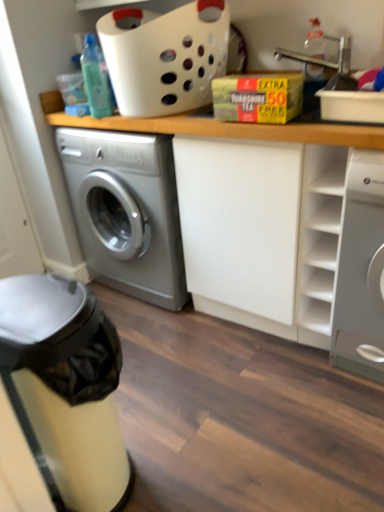
This screenshot has width=384, height=512. Describe the element at coordinates (221, 127) in the screenshot. I see `wooden counter at center` at that location.

Where is `white glossy washing machine at right`? The height and width of the screenshot is (512, 384). white glossy washing machine at right is located at coordinates (361, 271).

Is matte silver dishwasher at lower left completely or partially inside translucent plastic bottle at upper left, the first bottle positioned from the left?

Definitely not — matte silver dishwasher at lower left is not inside translucent plastic bottle at upper left, the first bottle positioned from the left.

Is translucent plastic bottle at upper left, placed as the second bottle when sorted from right to left, in front of matte silver dishwasher at lower left?

No, translucent plastic bottle at upper left, placed as the second bottle when sorted from right to left, is further to the viewer.

Which of these two, translucent plastic bottle at upper left, the first bottle positioned from the left, or matte silver dishwasher at lower left, is thinner?

Thinner between the two is translucent plastic bottle at upper left, the first bottle positioned from the left.

From a real-world perspective, which is physically above, matte silver dishwasher at lower left or wooden counter at center?

From a 3D spatial view, wooden counter at center is above.

In the image, is matte silver dishwasher at lower left positioned in front of or behind wooden counter at center?

Clearly, matte silver dishwasher at lower left is in front of wooden counter at center.

Looking at this image, is matte silver dishwasher at lower left oriented towards wooden counter at center?

Yes, matte silver dishwasher at lower left is oriented towards wooden counter at center.

Based on the photo, from the image's perspective, is wooden counter at center above or below translucent plastic bottle at upper left, the first bottle positioned from the left?

Based on their image positions, wooden counter at center is located beneath translucent plastic bottle at upper left, the first bottle positioned from the left.

Considering the positions of point (258, 129) and point (104, 64), is point (258, 129) closer or farther from the camera than point (104, 64)?

Point (258, 129).

In the scene shown: Considering the sizes of objects wooden counter at center and translucent plastic bottle at upper left, placed as the second bottle when sorted from right to left, in the image provided, who is taller, wooden counter at center or translucent plastic bottle at upper left, placed as the second bottle when sorted from right to left,?

With more height is wooden counter at center.

Considering the relative sizes of wooden counter at center and translucent plastic bottle at upper left, the first bottle positioned from the left, in the image provided, is wooden counter at center bigger than translucent plastic bottle at upper left, the first bottle positioned from the left,?

Yes, wooden counter at center is bigger than translucent plastic bottle at upper left, the first bottle positioned from the left.

Measure the distance between translucent plastic bottle at upper left, placed as the second bottle when sorted from right to left, and white plastic basket at upper center.

translucent plastic bottle at upper left, placed as the second bottle when sorted from right to left, and white plastic basket at upper center are 9.27 inches apart from each other.

Locate an element on the screen. Image resolution: width=384 pixels, height=512 pixels. basket in front of the translucent plastic bottle at upper left, the first bottle positioned from the left is located at coordinates click(x=165, y=56).

Is translucent plastic bottle at upper left, the first bottle positioned from the left, oriented towards white plastic basket at upper center?

Yes, translucent plastic bottle at upper left, the first bottle positioned from the left, is facing white plastic basket at upper center.

Who is taller, translucent plastic bottle at upper left, placed as the second bottle when sorted from right to left, or white plastic basket at upper center?

With more height is white plastic basket at upper center.

What's the angular difference between matte silver dishwasher at lower left and translucent plastic bottle at upper left, placed as the second bottle when sorted from right to left,'s facing directions?

The facing directions of matte silver dishwasher at lower left and translucent plastic bottle at upper left, placed as the second bottle when sorted from right to left, are 175 degrees apart.

From a real-world perspective, between matte silver dishwasher at lower left and translucent plastic bottle at upper left, placed as the second bottle when sorted from right to left, who is vertically higher?

translucent plastic bottle at upper left, placed as the second bottle when sorted from right to left, from a real-world perspective.

Visually, is matte silver dishwasher at lower left positioned to the left or to the right of translucent plastic bottle at upper left, the first bottle positioned from the left?

matte silver dishwasher at lower left is positioned on translucent plastic bottle at upper left, the first bottle positioned from the left,'s left side.

Considering the positions of points (119, 449) and (100, 80), is point (119, 449) closer to camera compared to point (100, 80)?

Yes, point (119, 449) is in front of point (100, 80).

Is matte silver dishwasher at lower left turned away from white plastic basket at upper center?

No, matte silver dishwasher at lower left is not facing away from white plastic basket at upper center.

Which is in front, point (8, 391) or point (222, 42)?

The point (8, 391) is more forward.

Considering the sizes of matte silver dishwasher at lower left and white plastic basket at upper center in the image, is matte silver dishwasher at lower left bigger or smaller than white plastic basket at upper center?

matte silver dishwasher at lower left is bigger than white plastic basket at upper center.

I want to click on dish washer below the clear plastic bottle at upper right, positioned as the 1th bottle in right-to-left order (from the image's perspective), so click(65, 389).

Which object is positioned more to the right, matte silver dishwasher at lower left or clear plastic bottle at upper right, the second bottle positioned from the left?

clear plastic bottle at upper right, the second bottle positioned from the left.

Who is taller, matte silver dishwasher at lower left or clear plastic bottle at upper right, positioned as the 1th bottle in right-to-left order?

matte silver dishwasher at lower left is taller.

Is matte silver dishwasher at lower left spatially inside clear plastic bottle at upper right, positioned as the 1th bottle in right-to-left order, or outside of it?

matte silver dishwasher at lower left exists outside the volume of clear plastic bottle at upper right, positioned as the 1th bottle in right-to-left order.

From the matte silver dishwasher at lower left, count 1st bottle to the right and point to it. Please provide its 2D coordinates.

[(96, 79)]

The image size is (384, 512). Find the location of `counter top behind the matte silver dishwasher at lower left`. counter top behind the matte silver dishwasher at lower left is located at coordinates (221, 127).

From the image, which object appears to be farther from white plastic basket at upper center, wooden counter at center or white glossy washing machine at right?

white glossy washing machine at right lies further to white plastic basket at upper center than the other object.

Which object lies further to the anchor point matte silver dishwasher at lower left, translucent plastic bottle at upper left, placed as the second bottle when sorted from right to left, or clear plastic bottle at upper right, positioned as the 1th bottle in right-to-left order?

clear plastic bottle at upper right, positioned as the 1th bottle in right-to-left order, is positioned further to the anchor matte silver dishwasher at lower left.

Consider the image. Which object lies nearer to the anchor point translucent plastic bottle at upper left, placed as the second bottle when sorted from right to left, matte silver dishwasher at lower left or white glossy washing machine at right?

white glossy washing machine at right is positioned closer to the anchor translucent plastic bottle at upper left, placed as the second bottle when sorted from right to left.

In the scene shown: Considering their positions, is wooden counter at center positioned closer to white glossy washing machine at right than clear plastic bottle at upper right, positioned as the 1th bottle in right-to-left order?

The object closer to white glossy washing machine at right is wooden counter at center.

Looking at the image, which one is located closer to white plastic basket at upper center, clear plastic bottle at upper right, the second bottle positioned from the left, or wooden counter at center?

wooden counter at center is closer to white plastic basket at upper center.

Considering their positions, is white glossy washing machine at right positioned closer to matte silver dishwasher at lower left than clear plastic bottle at upper right, positioned as the 1th bottle in right-to-left order?

white glossy washing machine at right is positioned closer to the anchor matte silver dishwasher at lower left.

Estimate the real-world distances between objects in this image. Which object is further from white glossy washing machine at right, translucent plastic bottle at upper left, placed as the second bottle when sorted from right to left, or matte silver dishwasher at lower left?

translucent plastic bottle at upper left, placed as the second bottle when sorted from right to left, is positioned further to the anchor white glossy washing machine at right.

When comparing their distances from white glossy washing machine at right, does clear plastic bottle at upper right, the second bottle positioned from the left, or matte silver dishwasher at lower left seem further?

Based on the image, matte silver dishwasher at lower left appears to be further to white glossy washing machine at right.

The width and height of the screenshot is (384, 512). Identify the location of counter top between clear plastic bottle at upper right, the second bottle positioned from the left, and white glossy washing machine at right from top to bottom. (221, 127).

At what (x,y) coordinates should I click in order to perform the action: click on bottle located between white plastic basket at upper center and white glossy washing machine at right in the left-right direction. Please return your answer as a coordinate pair (x, y). The height and width of the screenshot is (512, 384). Looking at the image, I should click on (315, 40).

This screenshot has width=384, height=512. In order to click on counter top between translucent plastic bottle at upper left, placed as the second bottle when sorted from right to left, and matte silver dishwasher at lower left, in the vertical direction in this screenshot , I will do `click(221, 127)`.

Find the location of a particular element. The height and width of the screenshot is (512, 384). basket between translucent plastic bottle at upper left, the first bottle positioned from the left, and wooden counter at center from left to right is located at coordinates [165, 56].